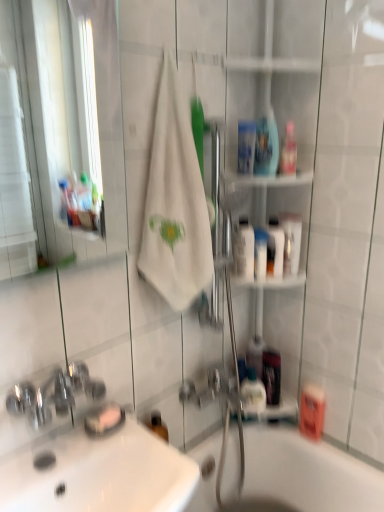
Question: From the image's perspective, is translucent plastic mouthwash at lower right, which appears as the 3th mouthwash when ordered from the bottom, below pink plastic mouthwash at upper center, the 8th mouthwash in the bottom-to-top sequence?

Choices:
 (A) yes
 (B) no

Answer: (A)

Question: Can you confirm if translucent plastic mouthwash at lower right, acting as the seventh mouthwash starting from the top, is thinner than pink plastic mouthwash at upper center, which is the second mouthwash in top-to-bottom order?

Choices:
 (A) yes
 (B) no

Answer: (B)

Question: Is translucent plastic mouthwash at lower right, which appears as the 3th mouthwash when ordered from the bottom, to the left of pink plastic mouthwash at upper center, which is the second mouthwash in top-to-bottom order, from the viewer's perspective?

Choices:
 (A) no
 (B) yes

Answer: (B)

Question: Can you confirm if translucent plastic mouthwash at lower right, acting as the seventh mouthwash starting from the top, is smaller than pink plastic mouthwash at upper center, which is the second mouthwash in top-to-bottom order?

Choices:
 (A) yes
 (B) no

Answer: (B)

Question: Is translucent plastic mouthwash at lower right, which appears as the 3th mouthwash when ordered from the bottom, bigger than pink plastic mouthwash at upper center, the 8th mouthwash in the bottom-to-top sequence?

Choices:
 (A) no
 (B) yes

Answer: (B)

Question: From the image's perspective, is translucent plastic mouthwash at lower right, acting as the seventh mouthwash starting from the top, on top of pink plastic mouthwash at upper center, the 8th mouthwash in the bottom-to-top sequence?

Choices:
 (A) no
 (B) yes

Answer: (A)

Question: From the image's perspective, is translucent plastic mouthwash at upper right, which is counted as the 5th mouthwash, starting from the bottom, below translucent plastic mouthwash at lower right, acting as the seventh mouthwash starting from the top?

Choices:
 (A) yes
 (B) no

Answer: (B)

Question: Is translucent plastic mouthwash at upper right, which is counted as the 5th mouthwash, starting from the bottom, positioned with its back to translucent plastic mouthwash at lower right, which appears as the 3th mouthwash when ordered from the bottom?

Choices:
 (A) yes
 (B) no

Answer: (B)

Question: Considering the relative sizes of translucent plastic mouthwash at upper right, marked as the fifth mouthwash in a top-to-bottom arrangement, and translucent plastic mouthwash at lower right, acting as the seventh mouthwash starting from the top, in the image provided, is translucent plastic mouthwash at upper right, marked as the fifth mouthwash in a top-to-bottom arrangement, bigger than translucent plastic mouthwash at lower right, acting as the seventh mouthwash starting from the top,?

Choices:
 (A) yes
 (B) no

Answer: (B)

Question: Does translucent plastic mouthwash at upper right, which is counted as the 5th mouthwash, starting from the bottom, have a greater width compared to translucent plastic mouthwash at lower right, which appears as the 3th mouthwash when ordered from the bottom?

Choices:
 (A) no
 (B) yes

Answer: (B)

Question: Is translucent plastic mouthwash at upper right, marked as the fifth mouthwash in a top-to-bottom arrangement, further to camera compared to translucent plastic mouthwash at lower right, which appears as the 3th mouthwash when ordered from the bottom?

Choices:
 (A) yes
 (B) no

Answer: (B)

Question: From the image's perspective, is translucent plastic mouthwash at upper right, marked as the fifth mouthwash in a top-to-bottom arrangement, located above translucent plastic mouthwash at lower right, which appears as the 3th mouthwash when ordered from the bottom?

Choices:
 (A) no
 (B) yes

Answer: (B)

Question: Is clear plastic mouthwash at upper center, which is the 3th mouthwash from top to bottom, oriented away from white glossy bottle at center-right, arranged as the 6th mouthwash when viewed from the top?

Choices:
 (A) no
 (B) yes

Answer: (A)